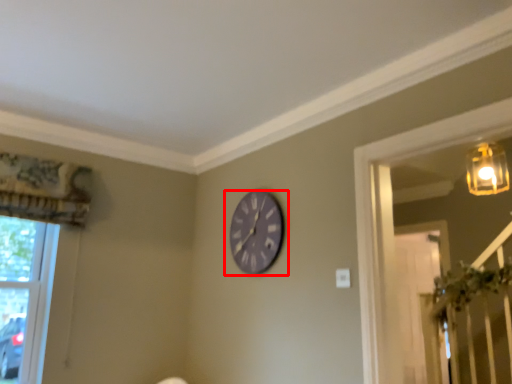
Question: From the image's perspective, where is wall clock (annotated by the red box) located relative to window?

Choices:
 (A) below
 (B) above

Answer: (B)